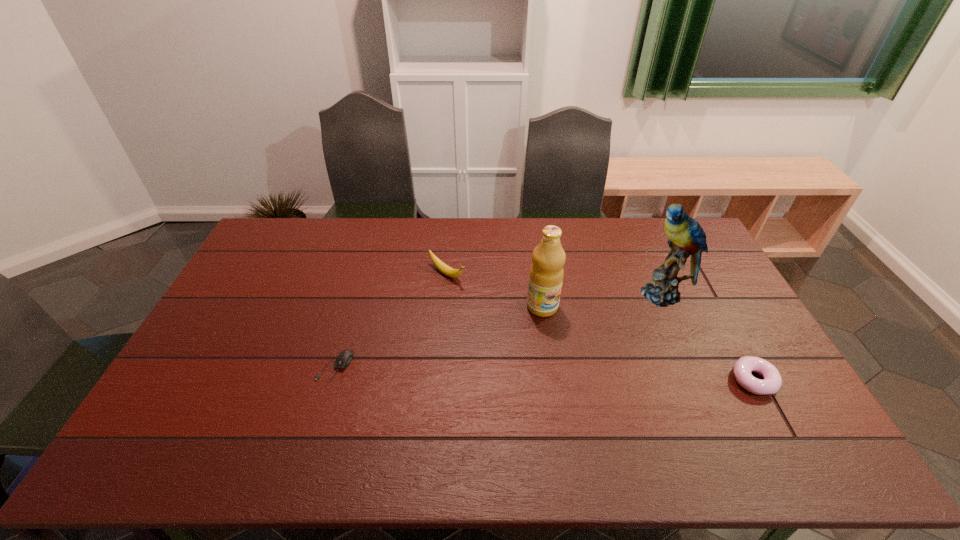
Image resolution: width=960 pixels, height=540 pixels. I want to click on doughnut located at the right edge, so click(x=742, y=369).

The image size is (960, 540). Identify the location of parrot that is at the right edge. (686, 237).

Where is `object located in the near right corner section of the desktop`? The image size is (960, 540). object located in the near right corner section of the desktop is located at coordinates coord(742,369).

I want to click on vacant space at the far edge of the desktop, so 410,226.

This screenshot has height=540, width=960. In order to click on vacant space at the near edge of the desktop in this screenshot , I will do `click(295, 414)`.

At what (x,y) coordinates should I click in order to perform the action: click on vacant space at the left edge. Please return your answer as a coordinate pair (x, y). Looking at the image, I should click on (248, 321).

This screenshot has width=960, height=540. In the image, there is a desktop. Find the location of `vacant space at the far left corner`. vacant space at the far left corner is located at coordinates (310, 220).

Locate an element on the screen. free spot at the near right corner of the desktop is located at coordinates (774, 408).

You are a GUI agent. You are given a task and a screenshot of the screen. Output one action in this format:
    pyautogui.click(x=<x>, y=<y>)
    Task: Click on the unoccupied position between the mouse and the doughnut
    
    Given the screenshot: What is the action you would take?
    pyautogui.click(x=544, y=373)

Where is `free area in between the doughnut and the second object from left to right`? The image size is (960, 540). free area in between the doughnut and the second object from left to right is located at coordinates (600, 327).